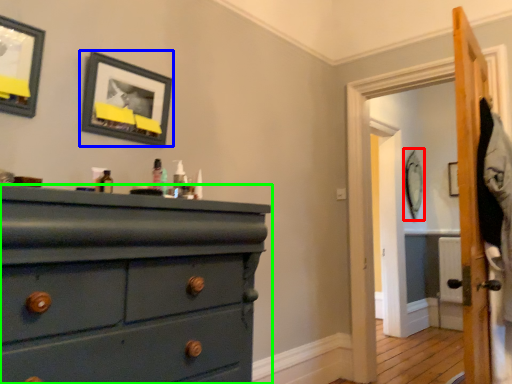
Question: Estimate the real-world distances between objects in this image. Which object is farther from picture frame (highlighted by a red box), picture frame (highlighted by a blue box) or chest of drawers (highlighted by a green box)?

Choices:
 (A) picture frame
 (B) chest of drawers

Answer: (B)